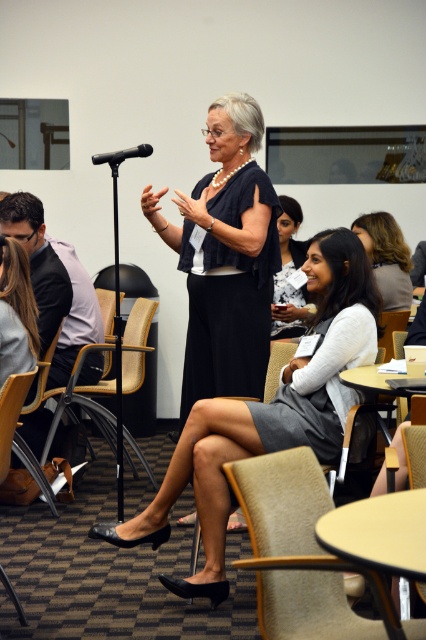
Does dark blue textured dress at center appear over dark brown hair at lower left?

Yes, dark blue textured dress at center is above dark brown hair at lower left.

The image size is (426, 640). What do you see at coordinates (230, 298) in the screenshot? I see `dark blue textured dress at center` at bounding box center [230, 298].

Does point (241, 211) come farther from viewer compared to point (37, 352)?

No, it is not.

Identify the location of dark blue textured dress at center. The width and height of the screenshot is (426, 640). (230, 298).

This screenshot has height=640, width=426. Describe the element at coordinates (386, 257) in the screenshot. I see `dark brown hair at center` at that location.

Does dark brown hair at center appear over black plastic microphone at upper left?

Incorrect, dark brown hair at center is not positioned above black plastic microphone at upper left.

Which is in front, point (403, 257) or point (144, 147)?

Point (144, 147)

Where is `dark brown hair at center`? dark brown hair at center is located at coordinates (386, 257).

Between point (359, 225) and point (296, 209), which one is positioned in front?

Point (359, 225) is more forward.

In order to click on dark brown hair at center in this screenshot , I will do `click(386, 257)`.

At what (x,y) coordinates should I click in order to perform the action: click on dark brown hair at center. Please return your answer as a coordinate pair (x, y). Image resolution: width=426 pixels, height=640 pixels. Looking at the image, I should click on (386, 257).